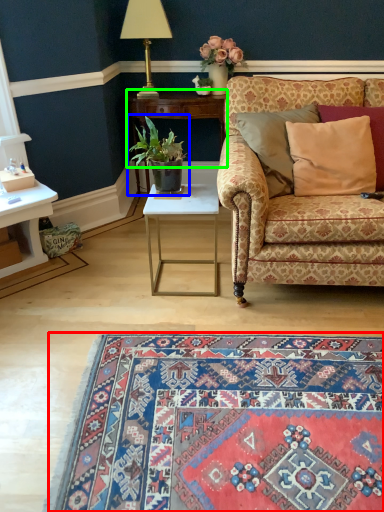
Question: Which is farther away from mat (highlighted by a red box)? houseplant (highlighted by a blue box) or table (highlighted by a green box)?

Choices:
 (A) houseplant
 (B) table

Answer: (B)